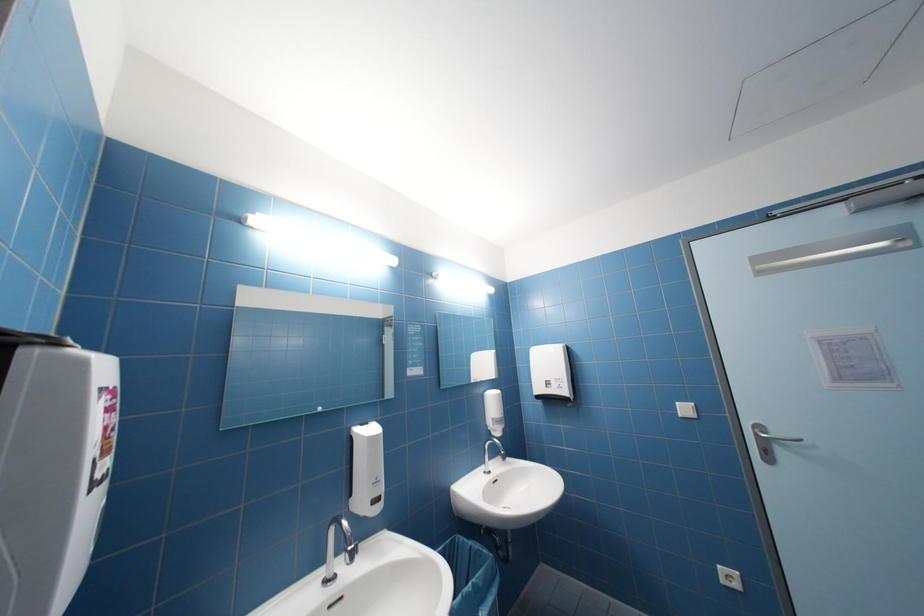
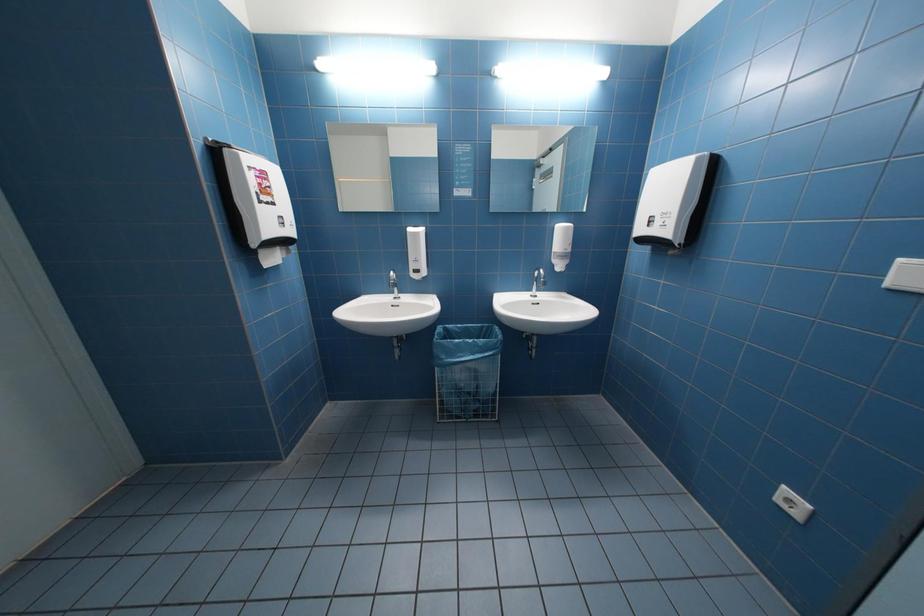
The images are taken continuously from a first-person perspective. In which direction is your viewpoint rotating?

The rotation direction of the camera is left-down.